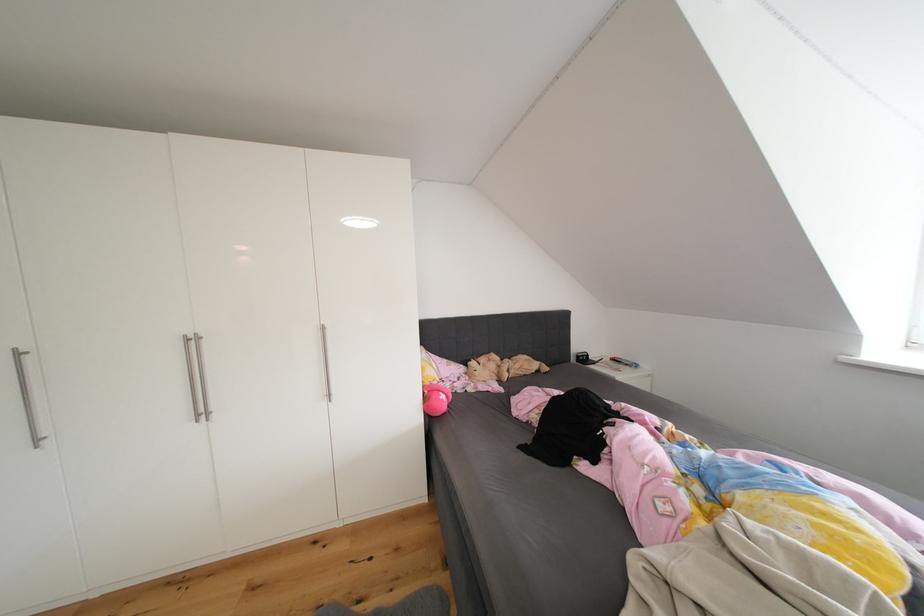
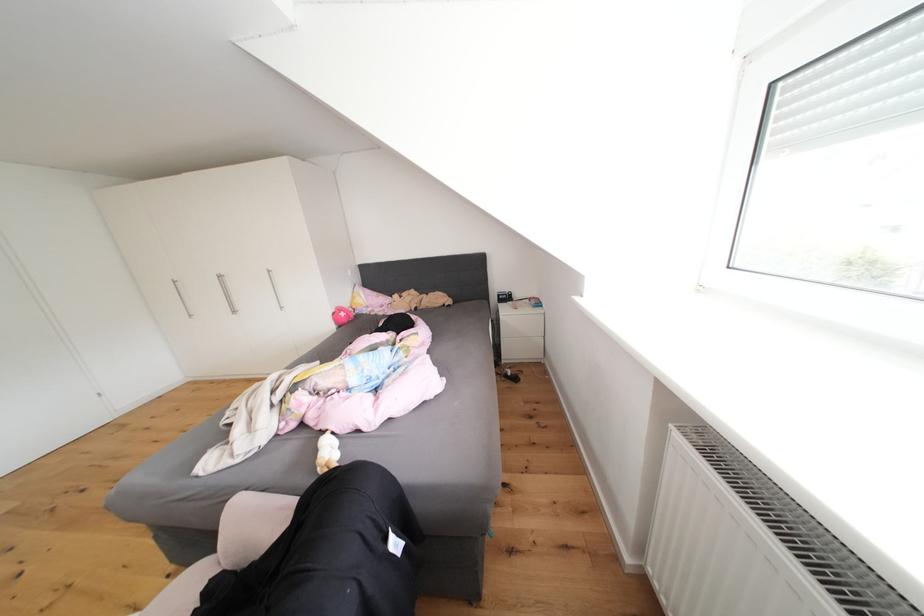
Locate, in the second image, the point that corresponds to point (435, 402) in the first image.

(343, 318)